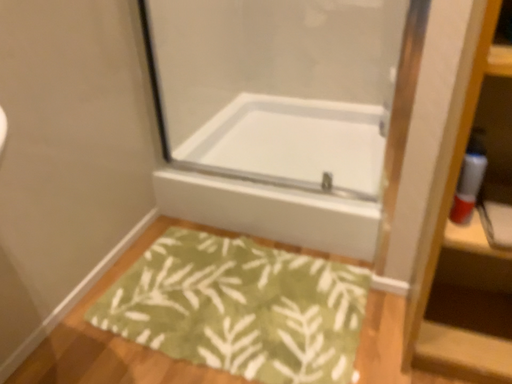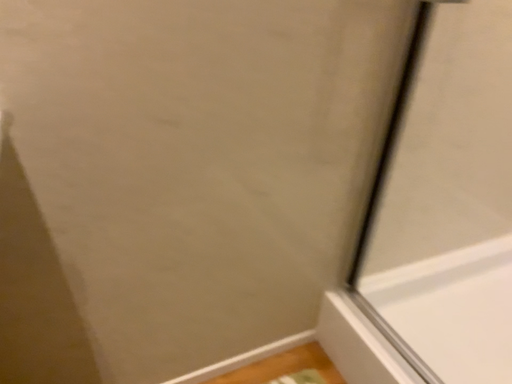
Question: Which way did the camera rotate in the video?

Choices:
 (A) rotated left
 (B) rotated right

Answer: (A)